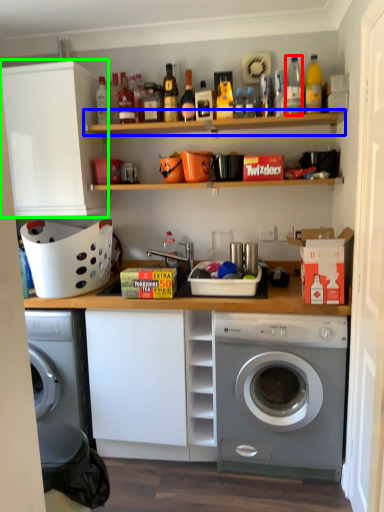
Question: Estimate the real-world distances between objects in this image. Which object is closer to bottle (highlighted by a red box), shelf (highlighted by a blue box) or cabinetry (highlighted by a green box)?

Choices:
 (A) shelf
 (B) cabinetry

Answer: (A)